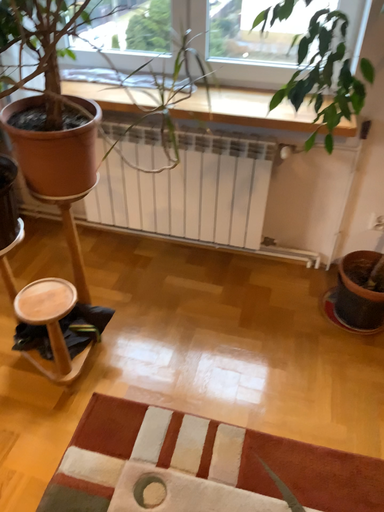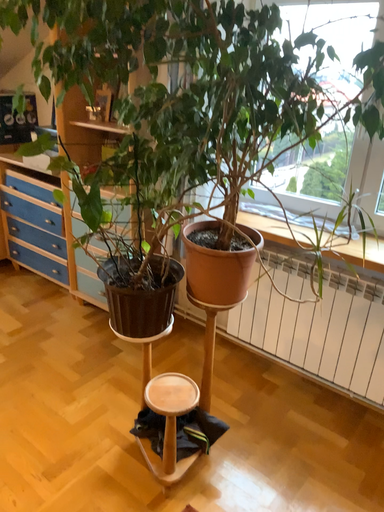
Question: Which way did the camera rotate in the video?

Choices:
 (A) rotated upward
 (B) rotated downward

Answer: (A)